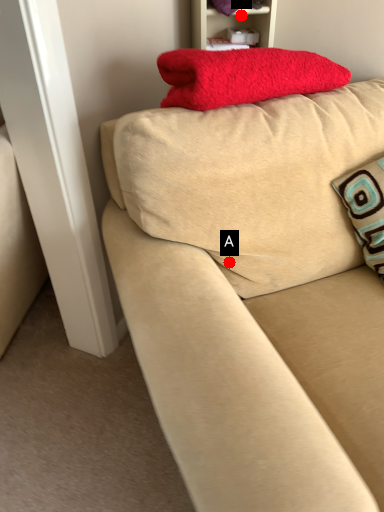
Question: Two points are circled on the image, labeled by A and B beside each circle. Which of the following is the closest to the observer?

Choices:
 (A) A is closer
 (B) B is closer

Answer: (A)